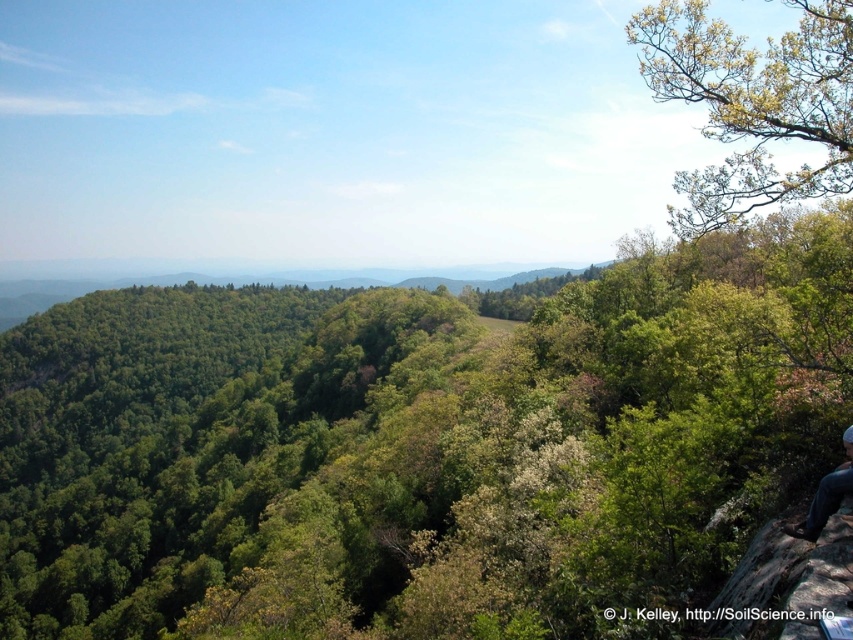
Between green leafy tree at upper right and blue jeans at lower right, which one is positioned lower?

blue jeans at lower right

Which is above, green leafy tree at upper right or blue jeans at lower right?

green leafy tree at upper right is above.

Find the location of `green leafy tree at upper right`. green leafy tree at upper right is located at coordinates (752, 104).

Locate an element on the screen. green leafy tree at upper right is located at coordinates (752, 104).

Does green leafy tree at upper center appear under green leafy tree at upper right?

Yes, green leafy tree at upper center is below green leafy tree at upper right.

Locate an element on the screen. This screenshot has height=640, width=853. green leafy tree at upper center is located at coordinates tap(419, 444).

The image size is (853, 640). In order to click on green leafy tree at upper center in this screenshot , I will do `click(419, 444)`.

Does green leafy tree at upper center have a greater width compared to blue jeans at lower right?

Yes, green leafy tree at upper center is wider than blue jeans at lower right.

Can you confirm if green leafy tree at upper center is taller than blue jeans at lower right?

Indeed, green leafy tree at upper center has a greater height compared to blue jeans at lower right.

This screenshot has height=640, width=853. Identify the location of green leafy tree at upper center. (419, 444).